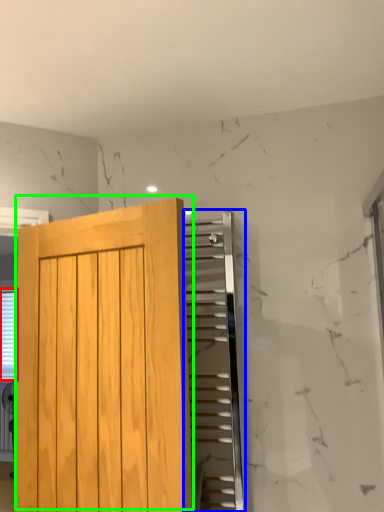
Question: Which object is positioned farthest from blind (highlighted by a red box)? Select from elevator (highlighted by a blue box) and door (highlighted by a green box).

Choices:
 (A) elevator
 (B) door

Answer: (A)